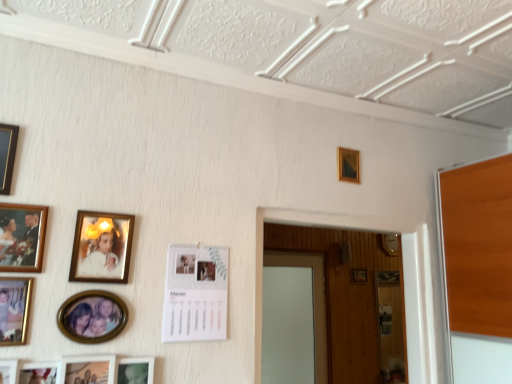
Question: Considering the relative sizes of matte black picture frame at lower left, the eighth picture frame when ordered from right to left, and matte silver picture frame at lower left, placed as the ninth picture frame when sorted from back to front, in the image provided, is matte black picture frame at lower left, the eighth picture frame when ordered from right to left, smaller than matte silver picture frame at lower left, placed as the ninth picture frame when sorted from back to front,?

Choices:
 (A) yes
 (B) no

Answer: (A)

Question: Is matte black picture frame at lower left, positioned as the 11th picture frame in back-to-front order, behind matte silver picture frame at lower left, which ranks as the 6th picture frame in left-to-right order?

Choices:
 (A) yes
 (B) no

Answer: (B)

Question: From a real-world perspective, does matte black picture frame at lower left, acting as the second picture frame starting from the front, stand above matte silver picture frame at lower left, which appears as the fourth picture frame when viewed from the front?

Choices:
 (A) yes
 (B) no

Answer: (A)

Question: From the image's perspective, is matte black picture frame at lower left, positioned as the 11th picture frame in back-to-front order, over matte silver picture frame at lower left, placed as the ninth picture frame when sorted from back to front?

Choices:
 (A) no
 (B) yes

Answer: (B)

Question: Is matte black picture frame at lower left, the eighth picture frame when ordered from right to left, bigger than matte silver picture frame at lower left, the 7th picture frame in the right-to-left sequence?

Choices:
 (A) no
 (B) yes

Answer: (A)

Question: Based on their sizes in the image, would you say white paper calendar at center, the tenth picture frame in the left-to-right sequence, is bigger or smaller than matte white photo frame at lower left, which is the fourth picture frame from right to left?

Choices:
 (A) big
 (B) small

Answer: (A)

Question: Do you think white paper calendar at center, marked as the third picture frame in a right-to-left arrangement, is within matte white photo frame at lower left, which is the ninth picture frame from left to right, or outside of it?

Choices:
 (A) inside
 (B) outside

Answer: (B)

Question: From a real-world perspective, is white paper calendar at center, the tenth picture frame in the left-to-right sequence, physically located above or below matte white photo frame at lower left, which is the fourth picture frame from right to left?

Choices:
 (A) below
 (B) above

Answer: (B)

Question: From the image's perspective, is white paper calendar at center, the tenth picture frame in the left-to-right sequence, positioned above or below matte white photo frame at lower left, which is the fourth picture frame from right to left?

Choices:
 (A) below
 (B) above

Answer: (B)

Question: Would you say gold-framed photo at lower left, the 10th picture frame from the back, is inside or outside matte black picture frame at lower left, the fifth picture frame from the left?

Choices:
 (A) outside
 (B) inside

Answer: (A)

Question: From the image's perspective, is gold-framed photo at lower left, marked as the third picture frame in a front-to-back arrangement, located above or below matte black picture frame at lower left, acting as the second picture frame starting from the front?

Choices:
 (A) above
 (B) below

Answer: (A)

Question: From a real-world perspective, is gold-framed photo at lower left, marked as the third picture frame in a front-to-back arrangement, physically located above or below matte black picture frame at lower left, positioned as the 11th picture frame in back-to-front order?

Choices:
 (A) above
 (B) below

Answer: (A)

Question: Does point (6, 324) appear closer or farther from the camera than point (35, 382)?

Choices:
 (A) farther
 (B) closer

Answer: (A)

Question: From a real-world perspective, is wooden picture frame at upper center, acting as the twelfth picture frame starting from the front, above or below matte gold picture frame at lower left, the 6th picture frame viewed from the right?

Choices:
 (A) above
 (B) below

Answer: (A)

Question: In terms of size, does wooden picture frame at upper center, acting as the first picture frame starting from the right, appear bigger or smaller than matte gold picture frame at lower left, which appears as the 6th picture frame when viewed from the back?

Choices:
 (A) big
 (B) small

Answer: (B)